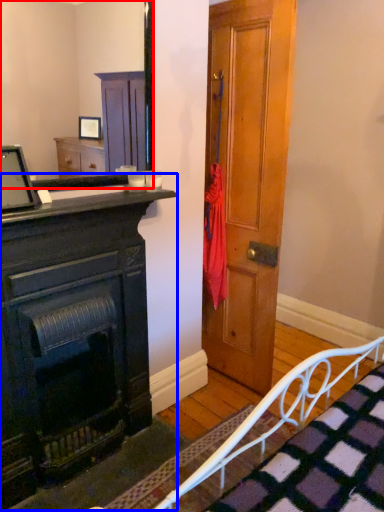
Question: Which point is closer to the camera, mirror (highlighted by a red box) or chest of drawers (highlighted by a blue box)?

Choices:
 (A) mirror
 (B) chest of drawers

Answer: (A)